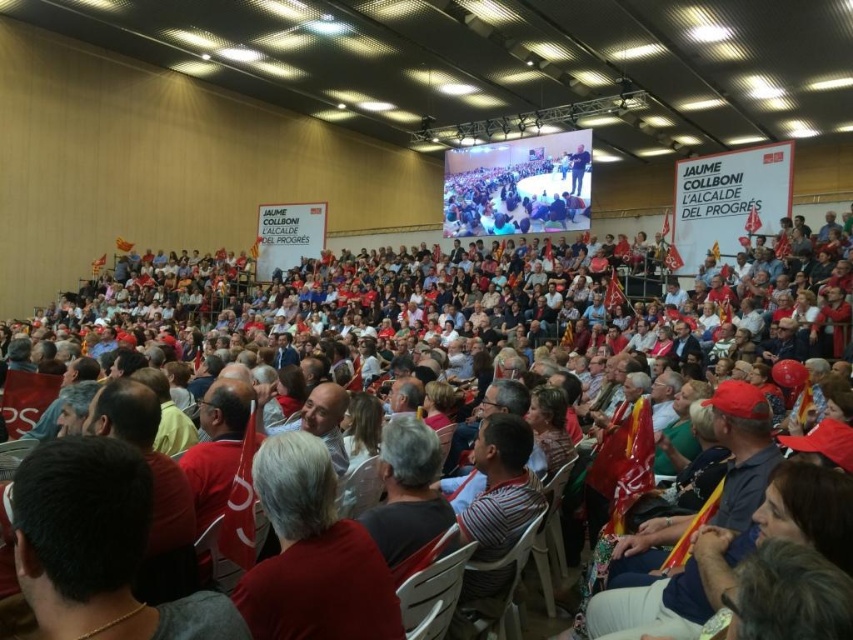
You are an event organizer who needs to adjust the stage setup. You notice two red fabric items on stage. Which one should you move first if you need to access the red fabric hat at center that is behind the red fabric at center?

You should move the red fabric at center first because it is in front of the red fabric hat at center, blocking access to it.

You are at the center of the hall and see the red fabric at center and the red fabric hat at center. Which one is more to the left?

The red fabric at center is more to the left because it is positioned on the left side of the red fabric hat at center.